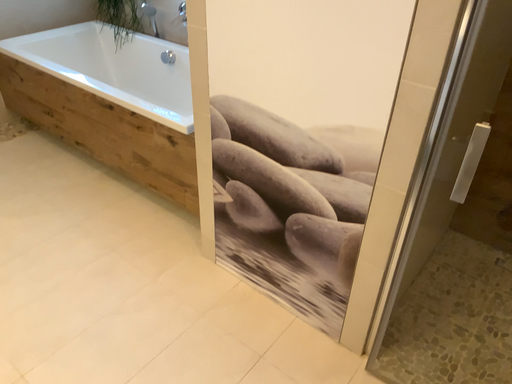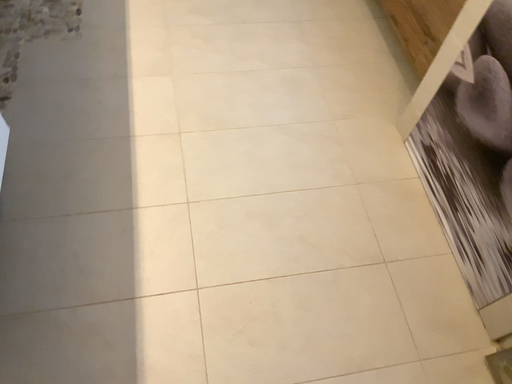
Question: Which way did the camera rotate in the video?

Choices:
 (A) rotated upward
 (B) rotated downward

Answer: (B)